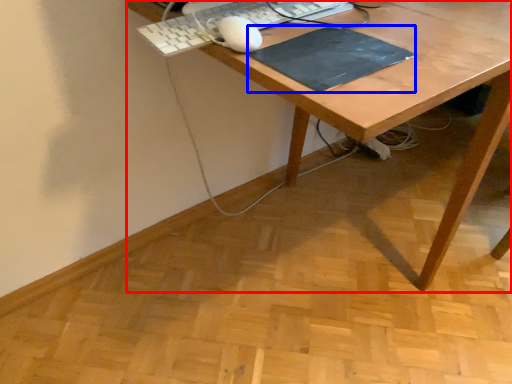
Question: Which object appears closest to the camera in this image, desk (highlighted by a red box) or mousepad (highlighted by a blue box)?

Choices:
 (A) desk
 (B) mousepad

Answer: (A)